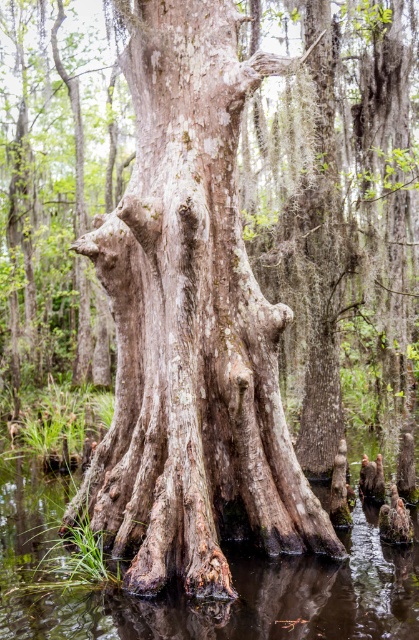
Does smooth bark tree trunk at center lie behind brown muddy water at lower center?

Yes, it is behind brown muddy water at lower center.

Does point (230, 12) come closer to viewer compared to point (383, 620)?

No.

Is point (172, 492) more distant than point (336, 592)?

Yes, point (172, 492) is behind point (336, 592).

Image resolution: width=419 pixels, height=640 pixels. I want to click on smooth bark tree trunk at center, so click(191, 324).